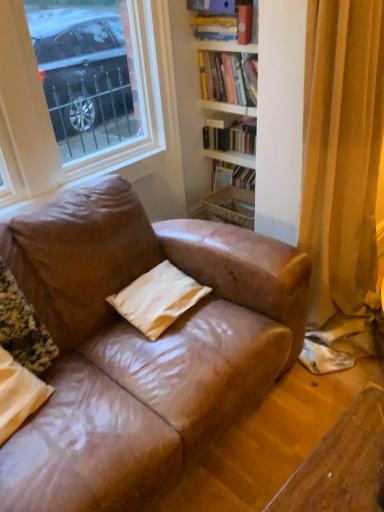
Question: Is matte beige pillow at lower left, the first pillow when ordered from left to right, directly adjacent to white matte pillow at center, the first pillow from the right?

Choices:
 (A) no
 (B) yes

Answer: (A)

Question: Is matte beige pillow at lower left, the second pillow from the right, not near white matte pillow at center, the first pillow from the right?

Choices:
 (A) yes
 (B) no

Answer: (B)

Question: Does matte beige pillow at lower left, the second pillow from the right, have a greater height compared to white matte pillow at center, the 2th pillow from the left?

Choices:
 (A) no
 (B) yes

Answer: (B)

Question: Is matte beige pillow at lower left, the second pillow from the right, at the left side of white matte pillow at center, the 2th pillow from the left?

Choices:
 (A) yes
 (B) no

Answer: (A)

Question: From a real-world perspective, is matte beige pillow at lower left, the first pillow when ordered from left to right, under white matte pillow at center, the first pillow from the right?

Choices:
 (A) no
 (B) yes

Answer: (A)

Question: Considering the relative positions of matte beige pillow at lower left, the second pillow from the right, and white matte pillow at center, the first pillow from the right, in the image provided, is matte beige pillow at lower left, the second pillow from the right, behind white matte pillow at center, the first pillow from the right,?

Choices:
 (A) yes
 (B) no

Answer: (B)

Question: Could you tell me if matte beige pillow at lower left, the second pillow from the right, is facing white matte bookshelf at upper center, acting as the 3th book starting from the top?

Choices:
 (A) yes
 (B) no

Answer: (B)

Question: Does matte beige pillow at lower left, the first pillow when ordered from left to right, appear on the right side of white matte bookshelf at upper center, acting as the 3th book starting from the top?

Choices:
 (A) no
 (B) yes

Answer: (A)

Question: Does matte beige pillow at lower left, the second pillow from the right, have a lesser height compared to white matte bookshelf at upper center, acting as the 3th book starting from the top?

Choices:
 (A) yes
 (B) no

Answer: (B)

Question: From the image's perspective, is matte beige pillow at lower left, the first pillow when ordered from left to right, located above white matte bookshelf at upper center, which is counted as the first book, starting from the bottom?

Choices:
 (A) yes
 (B) no

Answer: (B)

Question: Considering the relative sizes of matte beige pillow at lower left, the first pillow when ordered from left to right, and white matte bookshelf at upper center, which is counted as the first book, starting from the bottom, in the image provided, is matte beige pillow at lower left, the first pillow when ordered from left to right, wider than white matte bookshelf at upper center, which is counted as the first book, starting from the bottom,?

Choices:
 (A) no
 (B) yes

Answer: (B)

Question: Is matte beige pillow at lower left, the second pillow from the right, turned away from white matte bookshelf at upper center, which is counted as the first book, starting from the bottom?

Choices:
 (A) yes
 (B) no

Answer: (B)

Question: Does white matte pillow at center, the first pillow from the right, have a greater height compared to matte beige pillow at lower left, the second pillow from the right?

Choices:
 (A) no
 (B) yes

Answer: (A)